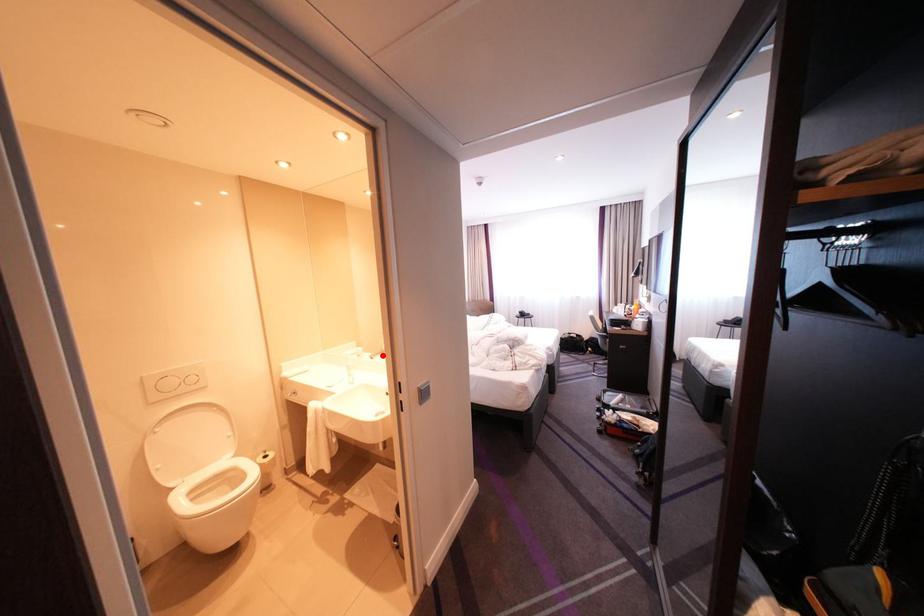
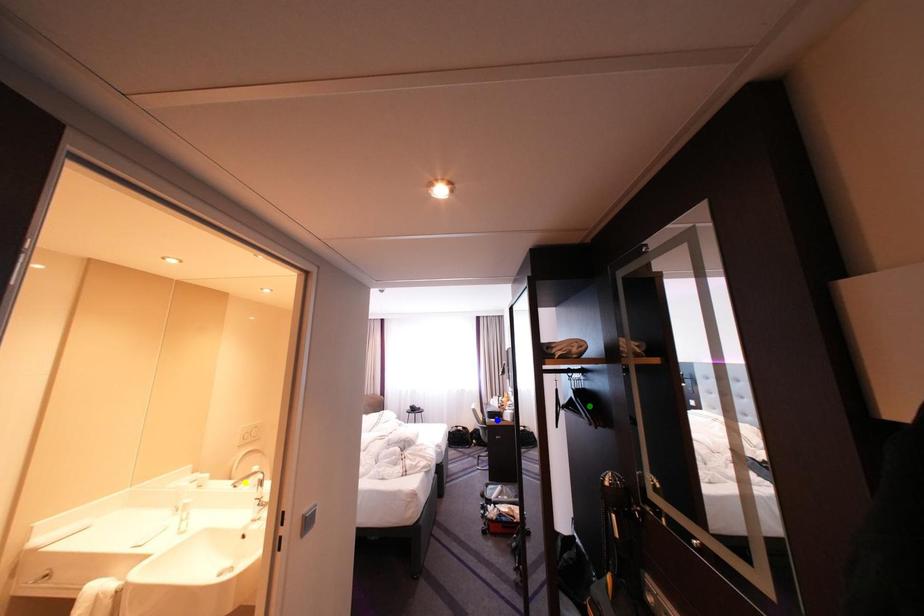
Question: I am providing you with two images of the same scene from different viewpoints. A red point is marked on the first image. You are given multiple points on the second image. In image 2, which mark is for the same physical point as the one in image 1?

Choices:
 (A) green point
 (B) blue point
 (C) yellow point

Answer: (C)